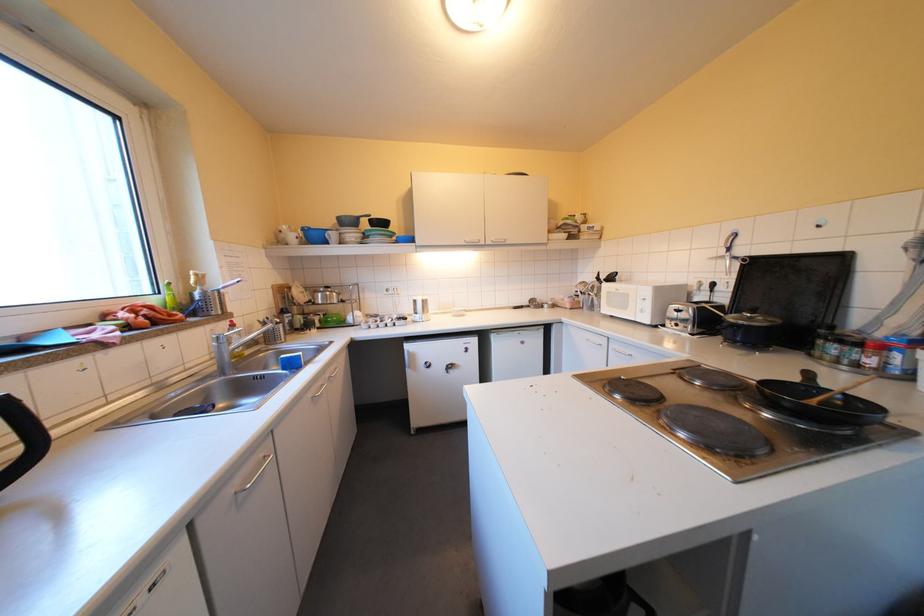
Where would you lift the kettle handle? Please return your answer as a coordinate pair (x, y).

(22, 438)